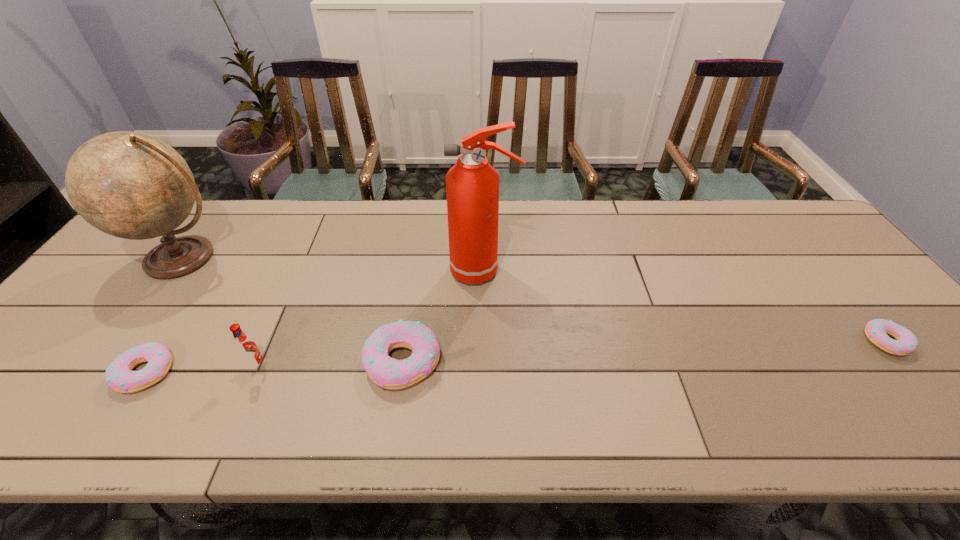
Find the location of `free point between the globe and the second doughnut from left to right`. free point between the globe and the second doughnut from left to right is located at coordinates (293, 310).

Locate an element on the screen. This screenshot has width=960, height=540. free area in between the fourth object from left to right and the fire extinguisher is located at coordinates (443, 316).

Where is `free space between the fourth shortest object and the shortest object`? This screenshot has width=960, height=540. free space between the fourth shortest object and the shortest object is located at coordinates (572, 354).

Identify the location of vacant region between the globe and the third tallest object. The height and width of the screenshot is (540, 960). (221, 313).

Image resolution: width=960 pixels, height=540 pixels. Identify the location of vacant area that lies between the rightmost object and the tallest doughnut. (644, 352).

Identify the location of free point between the root beer and the third object from right to left. (330, 364).

Locate which object is the second closest to the shortest object. Please provide its 2D coordinates. Your answer should be formatted as a tuple, i.e. [(x, y)], where the tuple contains the x and y coordinates of a point satisfying the conditions above.

[(389, 373)]

Identify which object is the fourth closest to the leftmost doughnut. Please provide its 2D coordinates. Your answer should be formatted as a tuple, i.e. [(x, y)], where the tuple contains the x and y coordinates of a point satisfying the conditions above.

[(472, 185)]

Choose which doughnut is the second nearest neighbor to the tallest doughnut. Please provide its 2D coordinates. Your answer should be formatted as a tuple, i.e. [(x, y)], where the tuple contains the x and y coordinates of a point satisfying the conditions above.

[(876, 330)]

Choose which doughnut is the nearest neighbor to the fourth shortest object. Please provide its 2D coordinates. Your answer should be formatted as a tuple, i.e. [(x, y)], where the tuple contains the x and y coordinates of a point satisfying the conditions above.

[(119, 376)]